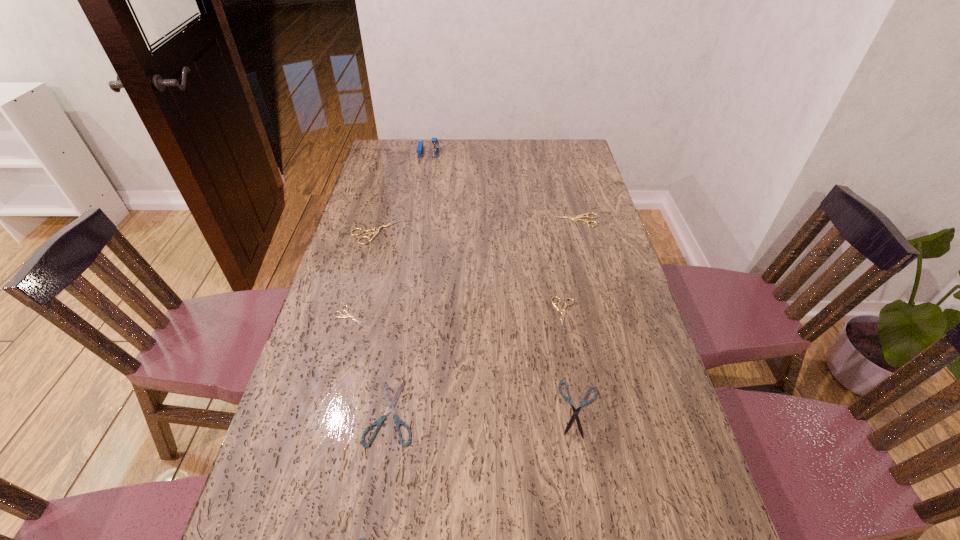
At what (x,y) coordinates should I click in order to perform the action: click on vacant space at the left edge of the desktop. Please return your answer as a coordinate pair (x, y). Looking at the image, I should click on (379, 248).

Locate an element on the screen. vacant space at the far left corner of the desktop is located at coordinates (389, 166).

Identify the location of vacant region at the far right corner of the desktop. This screenshot has height=540, width=960. (548, 151).

Find the location of `vacant area that lies between the biggest black shears and the second smallest beige shears`. vacant area that lies between the biggest black shears and the second smallest beige shears is located at coordinates (478, 363).

You are a GUI agent. You are given a task and a screenshot of the screen. Output one action in this format:
    pyautogui.click(x=<x>, y=<y>)
    Task: Click on the free space between the biggest black shears and the third smallest beige shears
    The image size is (960, 540).
    Given the screenshot: What is the action you would take?
    pyautogui.click(x=484, y=316)

Identify the location of vacant space that's between the rightmost black shears and the blue stapler. (504, 281).

The width and height of the screenshot is (960, 540). Find the location of `vacant region between the stapler and the tallest shears`. vacant region between the stapler and the tallest shears is located at coordinates (402, 192).

Image resolution: width=960 pixels, height=540 pixels. I want to click on free space between the seventh shortest object and the tallest object, so click(x=402, y=192).

You are a GUI agent. You are given a task and a screenshot of the screen. Output one action in this format:
    pyautogui.click(x=<x>, y=<y>)
    Task: Click on the vacant area that lies between the smallest beige shears and the stapler
    
    Given the screenshot: What is the action you would take?
    pyautogui.click(x=389, y=234)

Locate which object ranks seventh in proximity to the tallest shears. Please provide its 2D coordinates. Your answer should be formatted as a tuple, i.e. [(x, y)], where the tuple contains the x and y coordinates of a point satisfying the conditions above.

[(361, 539)]